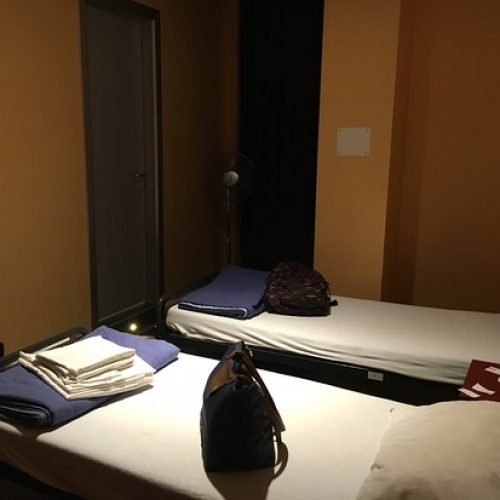
Where is `door frame`? The image size is (500, 500). door frame is located at coordinates (89, 177).